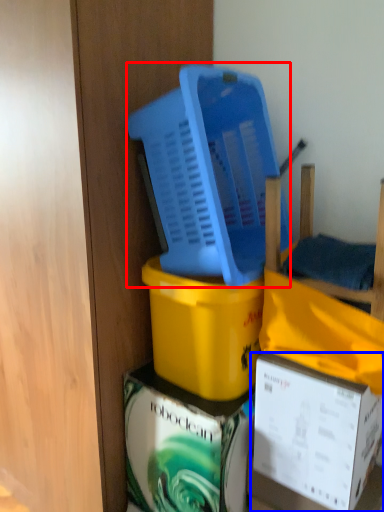
Question: Which of the following is the closest to the observer, basket (highlighted by a red box) or box (highlighted by a blue box)?

Choices:
 (A) basket
 (B) box

Answer: (A)